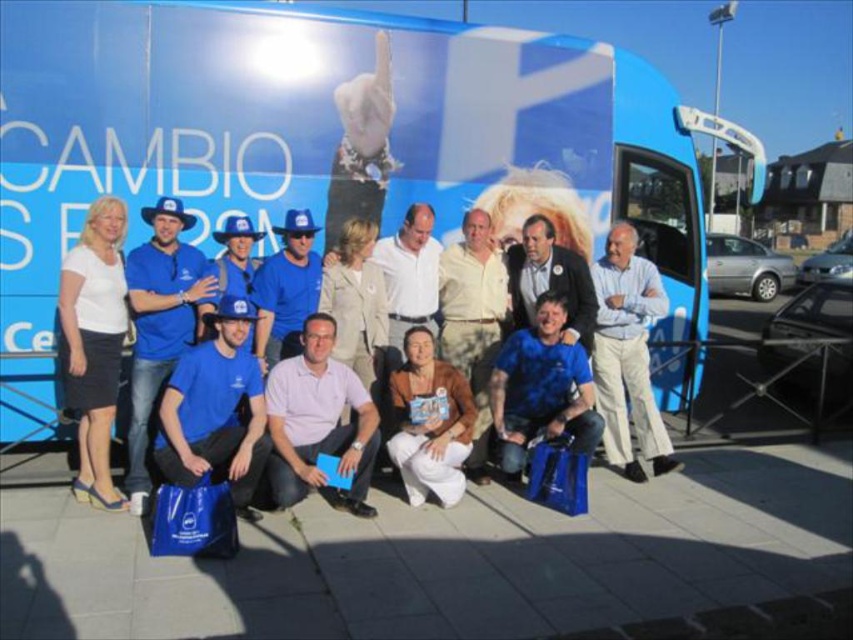
Who is more forward, [97,371] or [329,353]?

Point [97,371] is more forward.

Is white fabric skirt at left shorter than pink cotton shirt at center?

No, white fabric skirt at left is not shorter than pink cotton shirt at center.

Which is behind, point (80, 438) or point (299, 355)?

The point (299, 355) is behind.

At what (x,y) coordinates should I click in order to perform the action: click on white fabric skirt at left. Please return your answer as a coordinate pair (x, y). Looking at the image, I should click on (94, 342).

How distant is blue matte bus at center from blue fabric shirt at center?

blue matte bus at center is 11.07 feet away from blue fabric shirt at center.

Who is taller, blue matte bus at center or blue fabric shirt at center?

With more height is blue fabric shirt at center.

Image resolution: width=853 pixels, height=640 pixels. Find the location of `blue matte bus at center`. blue matte bus at center is located at coordinates (323, 141).

Does blue fabric bag at center have a larger size compared to pink cotton shirt at center?

Indeed, blue fabric bag at center has a larger size compared to pink cotton shirt at center.

This screenshot has height=640, width=853. What do you see at coordinates (456, 284) in the screenshot?
I see `blue fabric bag at center` at bounding box center [456, 284].

This screenshot has height=640, width=853. Identify the location of blue fabric bag at center. (456, 284).